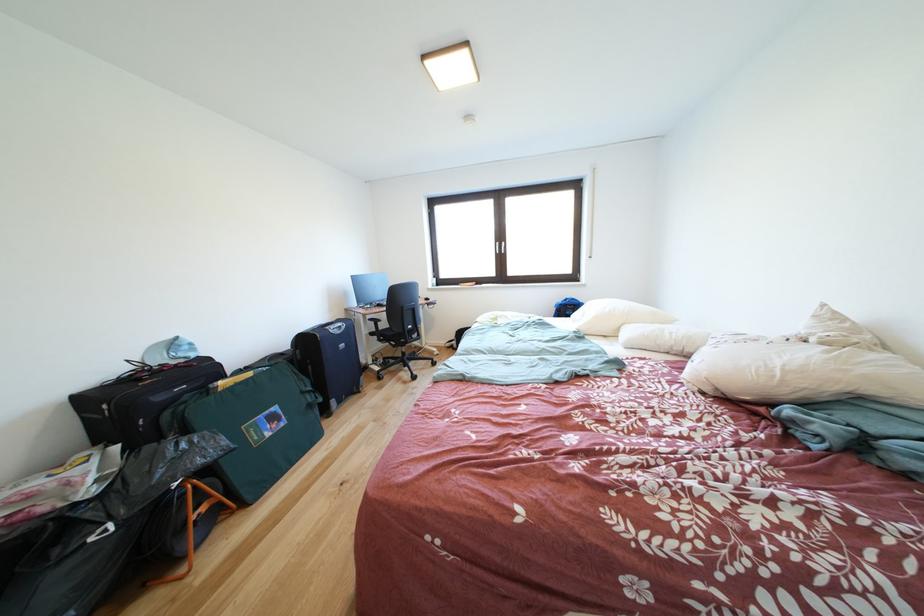
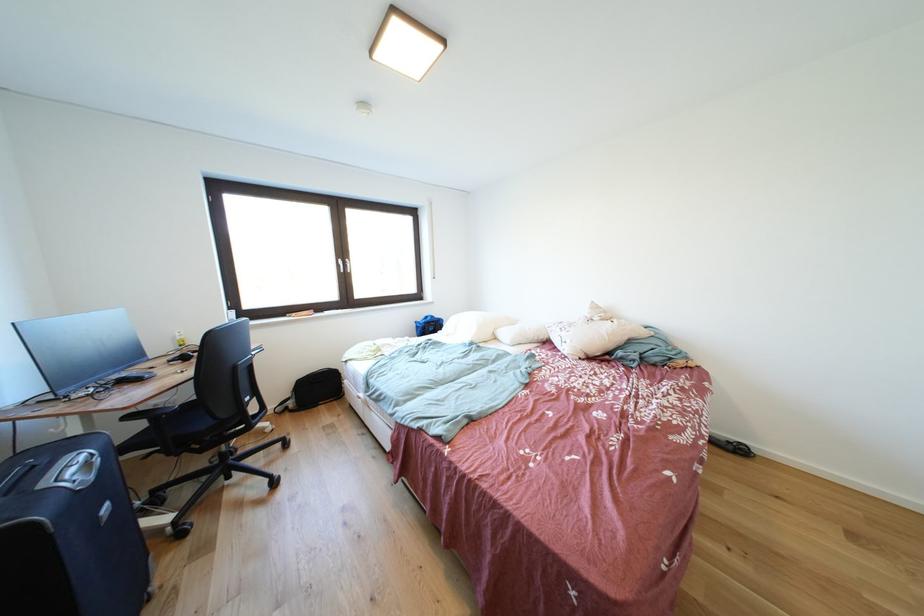
Where in the second image is the point corresponding to (x=463, y=347) from the first image?

(299, 408)